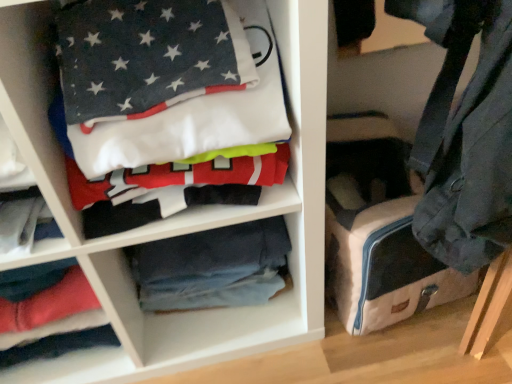
Locate an element on the screen. This screenshot has height=384, width=512. free space in front of blue denim jeans at center is located at coordinates (225, 340).